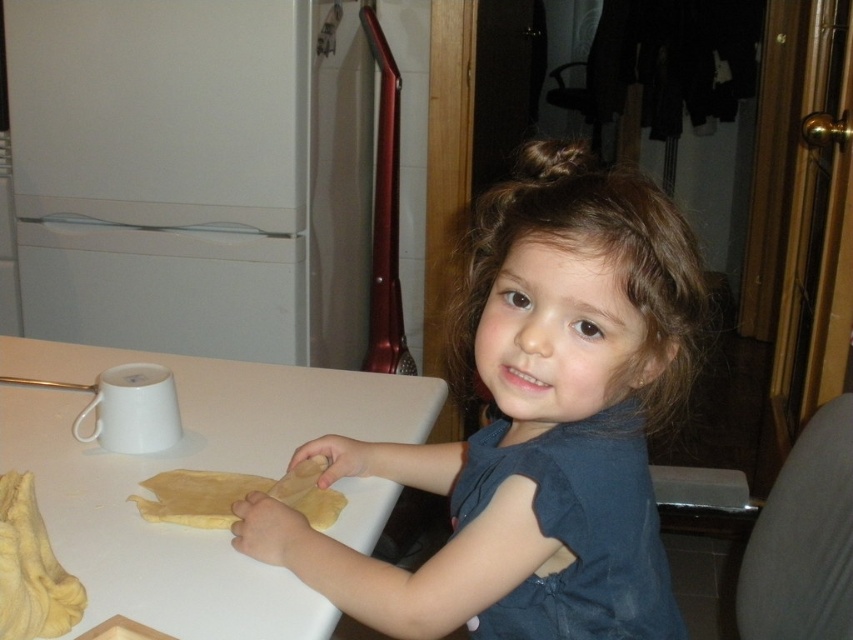
Between smooth brown hair at center and white matte table at center, which one has less height?

With less height is white matte table at center.

Is smooth brown hair at center below white matte table at center?

No.

Between point (526, 332) and point (50, 420), which one is positioned in front?

Positioned in front is point (526, 332).

Image resolution: width=853 pixels, height=640 pixels. Identify the location of smooth brown hair at center. (532, 424).

Is smooth brown hair at center closer to the viewer compared to yellow dough at center?

Yes, it is.

This screenshot has height=640, width=853. Describe the element at coordinates (532, 424) in the screenshot. I see `smooth brown hair at center` at that location.

Who is more forward, (x=473, y=262) or (x=318, y=522)?

Point (x=318, y=522) is in front.

Identify the location of smooth brown hair at center. (532, 424).

Image resolution: width=853 pixels, height=640 pixels. Identify the location of white matte table at center. (190, 468).